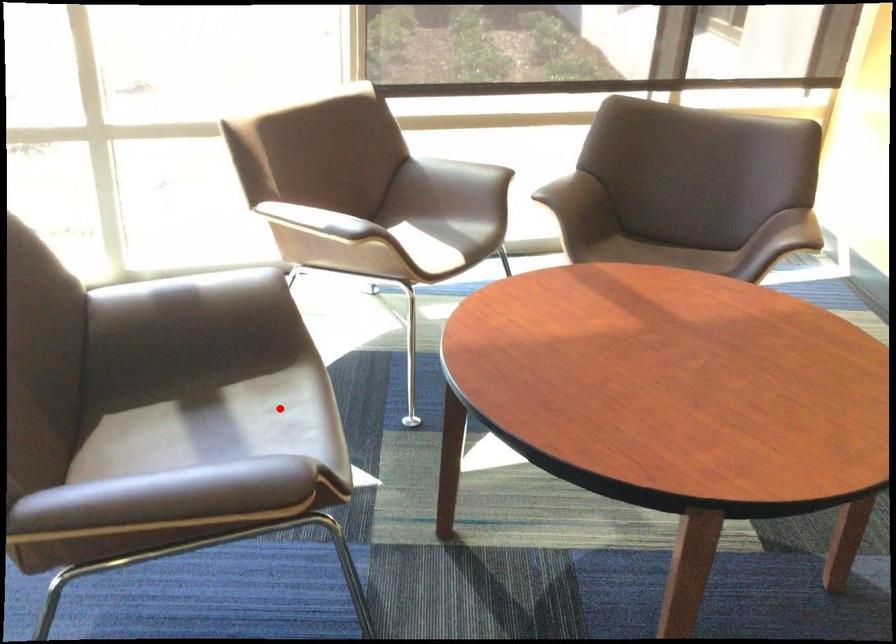
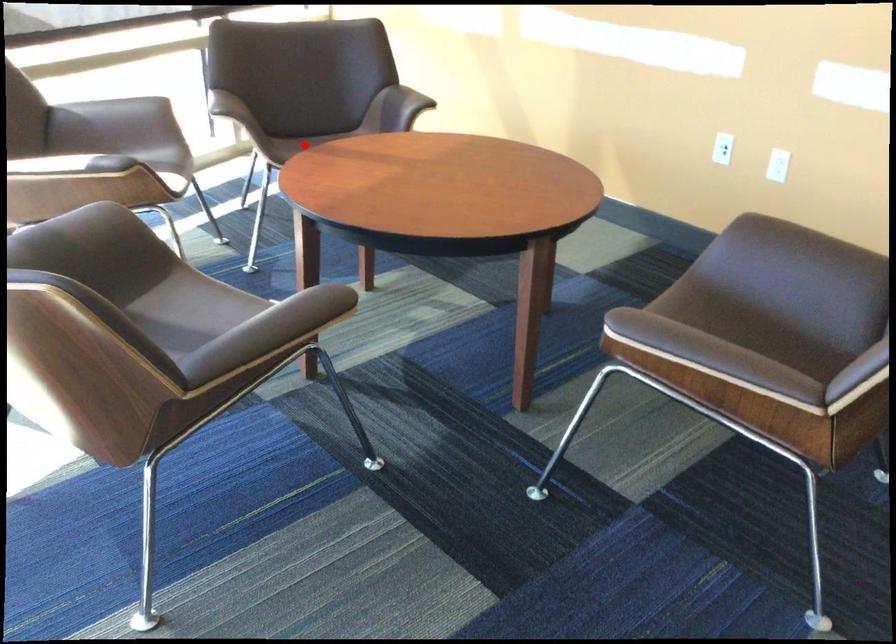
I am providing you with two images of the same scene from different viewpoints. A red point is marked on the first image and another point is marked on the second image. Is the marked point in image1 the same physical position as the marked point in image2?

No